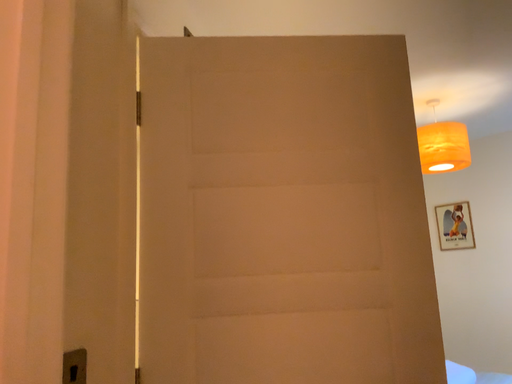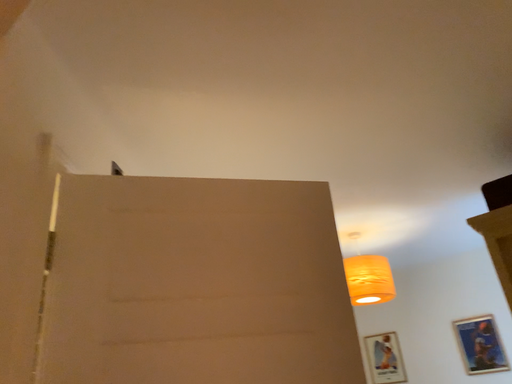
Question: How did the camera likely rotate when shooting the video?

Choices:
 (A) rotated right
 (B) rotated left

Answer: (A)